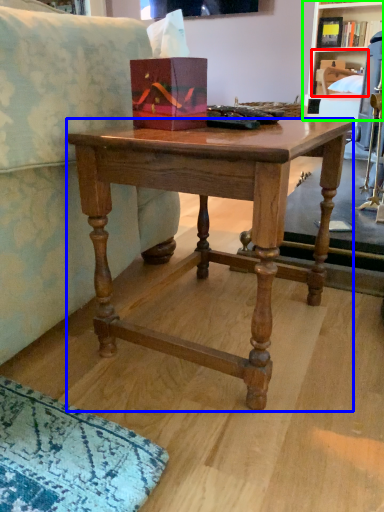
Question: Which object is the closest to the shelf (highlighted by a red box)? Choose among these: desk (highlighted by a blue box) or shelf (highlighted by a green box).

Choices:
 (A) desk
 (B) shelf

Answer: (B)